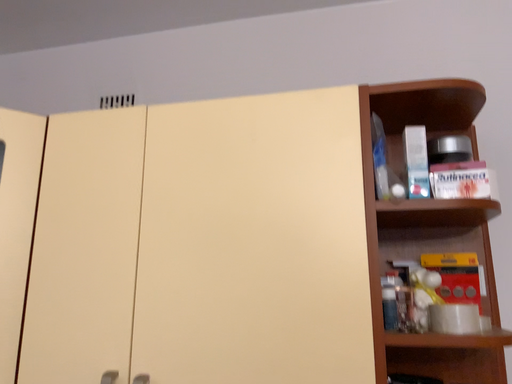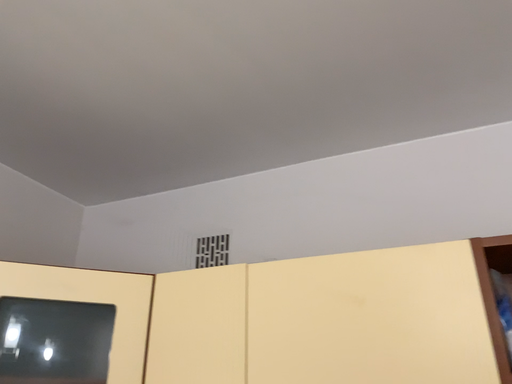
Question: How did the camera likely rotate when shooting the video?

Choices:
 (A) rotated upward
 (B) rotated downward

Answer: (A)